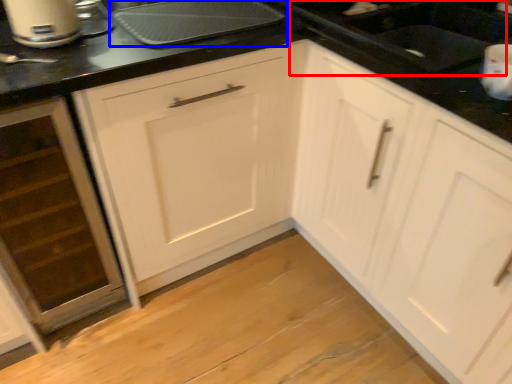
Question: Which point is further to the camera, sink (highlighted by a red box) or kitchen appliance (highlighted by a blue box)?

Choices:
 (A) sink
 (B) kitchen appliance

Answer: (B)